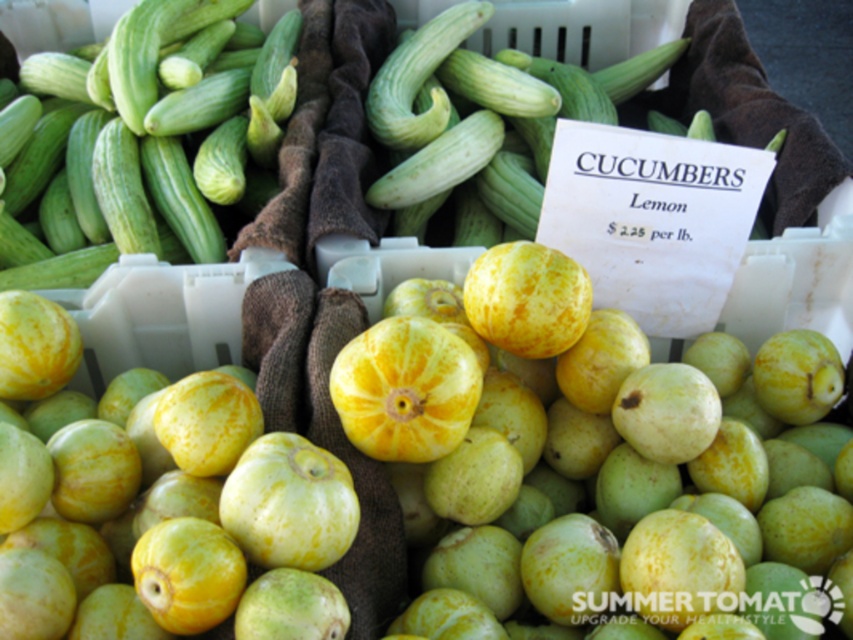
Question: Can you confirm if yellow matte melon at center is thinner than green matte cucumber at center?

Choices:
 (A) no
 (B) yes

Answer: (B)

Question: Is yellow matte melon at center positioned before green matte cucumber at upper left?

Choices:
 (A) no
 (B) yes

Answer: (B)

Question: Among these objects, which one is farthest from the camera?

Choices:
 (A) green matte melon at center
 (B) green matte cucumber at center
 (C) green matte cucumber at upper left
 (D) yellow matte melon at center

Answer: (B)

Question: Is yellow matte melon at center above green matte melon at center?

Choices:
 (A) no
 (B) yes

Answer: (B)

Question: Which object appears closest to the camera in this image?

Choices:
 (A) green matte cucumber at center
 (B) yellow matte melon at center

Answer: (B)

Question: Which point is farther to the camera?

Choices:
 (A) green matte melon at center
 (B) green matte cucumber at upper left
 (C) yellow matte melon at center
 (D) green matte cucumber at center

Answer: (D)